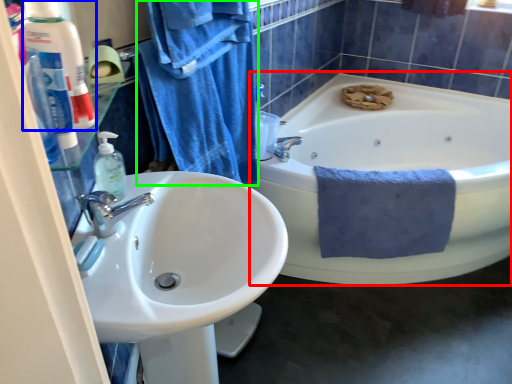
Question: Which object is the farthest from bathtub (highlighted by a red box)? Choose among these: toiletry (highlighted by a blue box) or bath towel (highlighted by a green box).

Choices:
 (A) toiletry
 (B) bath towel

Answer: (A)